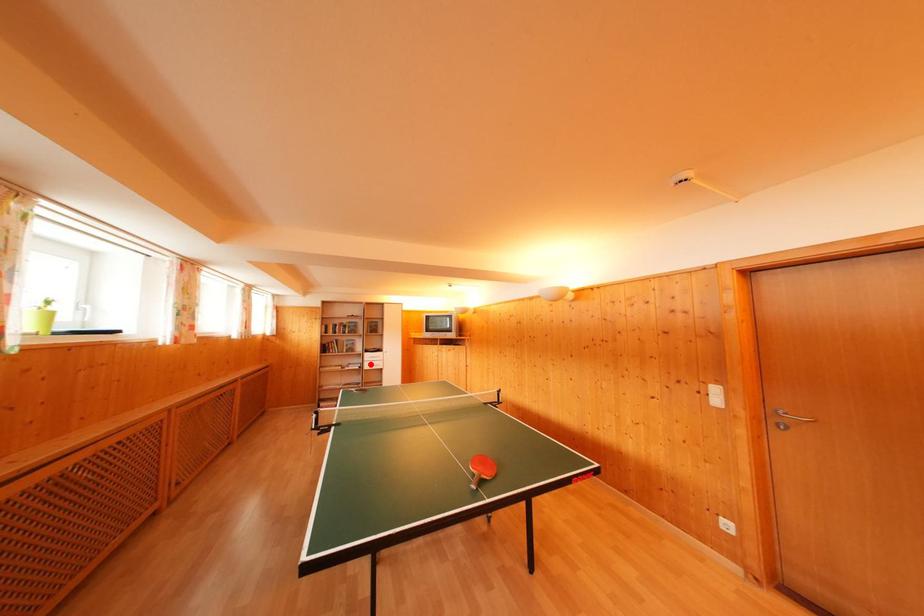
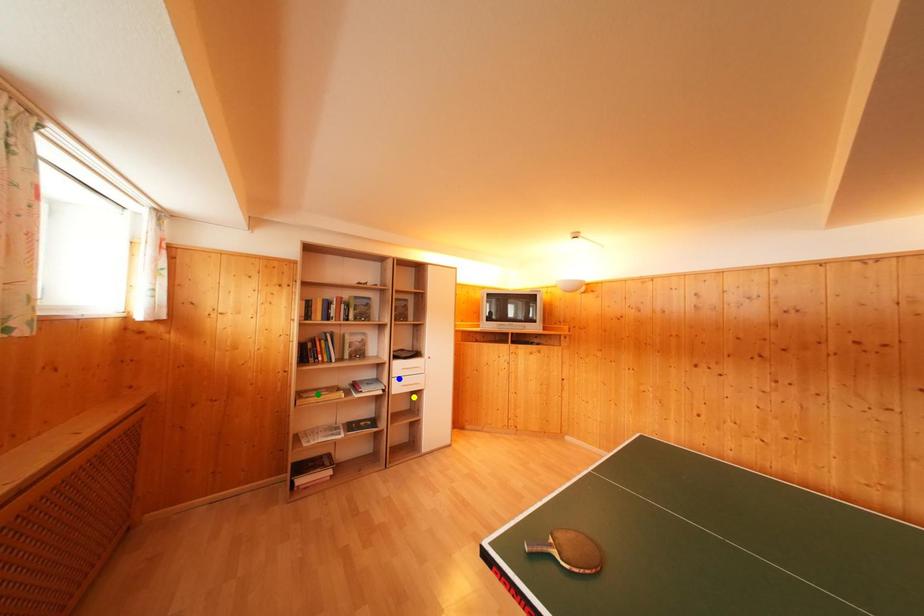
Question: I am providing you with two images of the same scene from different viewpoints. A red point is marked on the first image. You are given multiple points on the second image. Which spot in image 2 lines up with the point in image 1?

Choices:
 (A) green point
 (B) blue point
 (C) yellow point

Answer: (B)